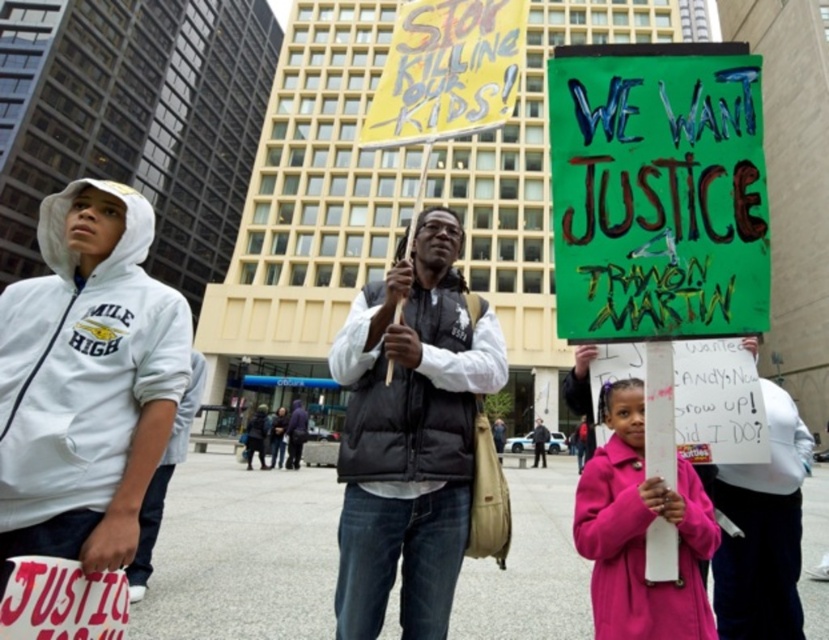
Can you confirm if white fleece sweatshirt at left is positioned below pink fabric coat at lower right?

No.

Which is more to the right, white fleece sweatshirt at left or pink fabric coat at lower right?

pink fabric coat at lower right is more to the right.

Which is in front, point (149, 326) or point (694, 483)?

Positioned in front is point (694, 483).

You are a GUI agent. You are given a task and a screenshot of the screen. Output one action in this format:
    pyautogui.click(x=<x>, y=<y>)
    Task: Click on the white fleece sweatshirt at left
    This screenshot has width=829, height=640.
    Given the screenshot: What is the action you would take?
    pyautogui.click(x=81, y=364)

In the scene shown: Who is taller, green painted cardboard sign at center or pink fabric coat at lower right?

Standing taller between the two is pink fabric coat at lower right.

At what (x,y) coordinates should I click in order to perform the action: click on green painted cardboard sign at center. Please return your answer as a coordinate pair (x, y). Image resolution: width=829 pixels, height=640 pixels. Looking at the image, I should click on (657, 192).

Is point (710, 273) closer to camera compared to point (686, 572)?

Yes, it is.

What are the coordinates of `green painted cardboard sign at center` in the screenshot? It's located at (657, 192).

Does point (667, 227) lie behind point (442, 410)?

No, it is in front of (442, 410).

Can you confirm if green painted cardboard sign at center is positioned to the right of black quilted vest at center?

Yes, green painted cardboard sign at center is to the right of black quilted vest at center.

Between point (556, 186) and point (343, 480), which one is positioned in front?

Point (556, 186) is in front.

Locate an element on the screen. The image size is (829, 640). green painted cardboard sign at center is located at coordinates (657, 192).